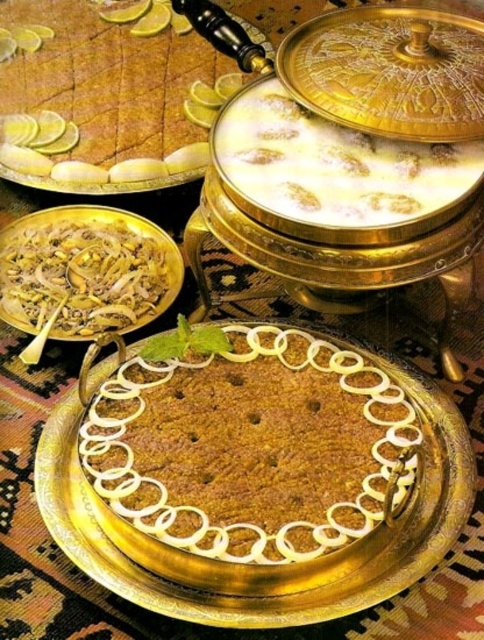
You are a guest at a dinner party and want to choose the taller item between the white creamy dessert at center and the white creamy rice at center. Which one should you select?

The white creamy dessert at center is taller than the white creamy rice at center, so you should select the white creamy dessert at center.

You are a guest at a dinner and want to eat the white creamy dessert at center and the white creamy rice at center. Which one is closer to you on the table?

The white creamy dessert at center is closer to you because it is in front of the white creamy rice at center.

You are a guest at a Middle Eastern feast and see both the brown crumbly cake at center and the golden textured cake at center on the table. Which cake is positioned to the right side of the other?

The brown crumbly cake at center is to the right of the golden textured cake at center.